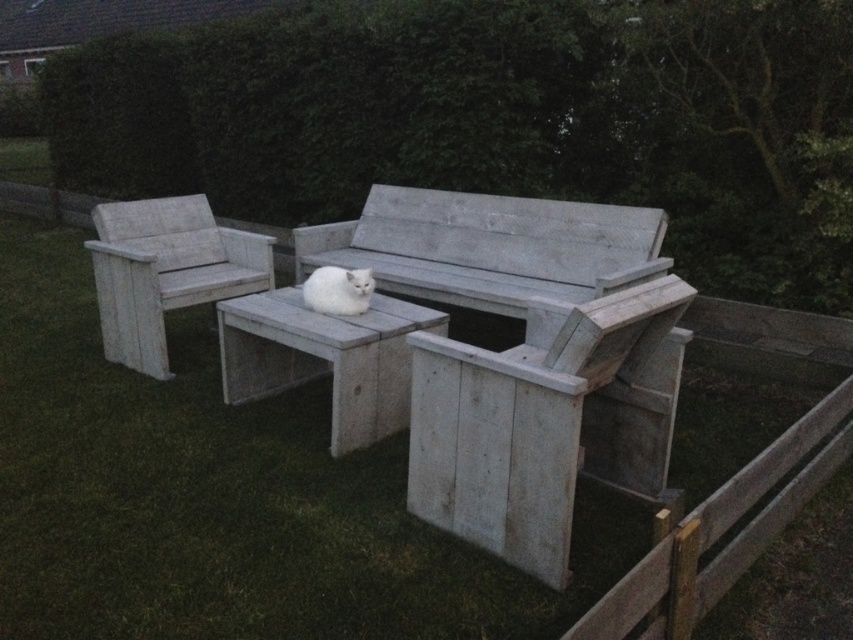
You are a gardener planning to trim the green leafy hedge at upper center and the white wood bench at left. Based on their positions, which object is located to the right of the other?

The green leafy hedge at upper center is positioned on the right side of white wood bench at left.

You are a landscape architect designing a garden layout. You need to place a new decorative fountain in the area between the green leafy hedge at upper center and the white wood bench at left. Considering their sizes, which object should the fountain be closer to?

The fountain should be placed closer to the green leafy hedge at upper center because it occupies less space than the white wood bench at left, allowing more room for the fountain near the bench.